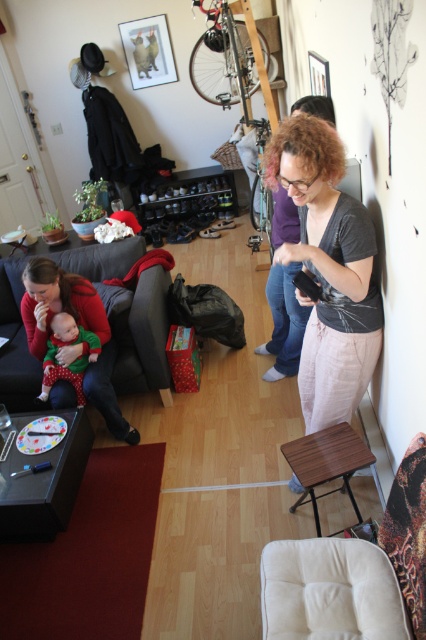
Which is more to the right, dark gray fabric couch at lower left or matte green baby at left?

matte green baby at left

Is dark gray fabric couch at lower left positioned behind matte green baby at left?

That is True.

The width and height of the screenshot is (426, 640). In order to click on dark gray fabric couch at lower left in this screenshot , I will do `click(129, 310)`.

Measure the distance between matte gray shirt at center and dark gray fabric couch at lower left.

matte gray shirt at center is 1.38 meters from dark gray fabric couch at lower left.

Describe the element at coordinates (328, 269) in the screenshot. I see `matte gray shirt at center` at that location.

You are a GUI agent. You are given a task and a screenshot of the screen. Output one action in this format:
    pyautogui.click(x=<x>, y=<y>)
    Task: Click on the matte gray shirt at center
    The image size is (426, 640).
    Given the screenshot: What is the action you would take?
    pyautogui.click(x=328, y=269)

Which of these two, beige fabric armchair at lower right or matte green baby at left, stands shorter?

With less height is matte green baby at left.

Between point (374, 611) and point (92, 355), which one is positioned in front?

Point (374, 611) is more forward.

Is point (347, 636) closer to viewer compared to point (66, 332)?

Yes.

Locate an element on the screen. Image resolution: width=426 pixels, height=640 pixels. beige fabric armchair at lower right is located at coordinates (354, 573).